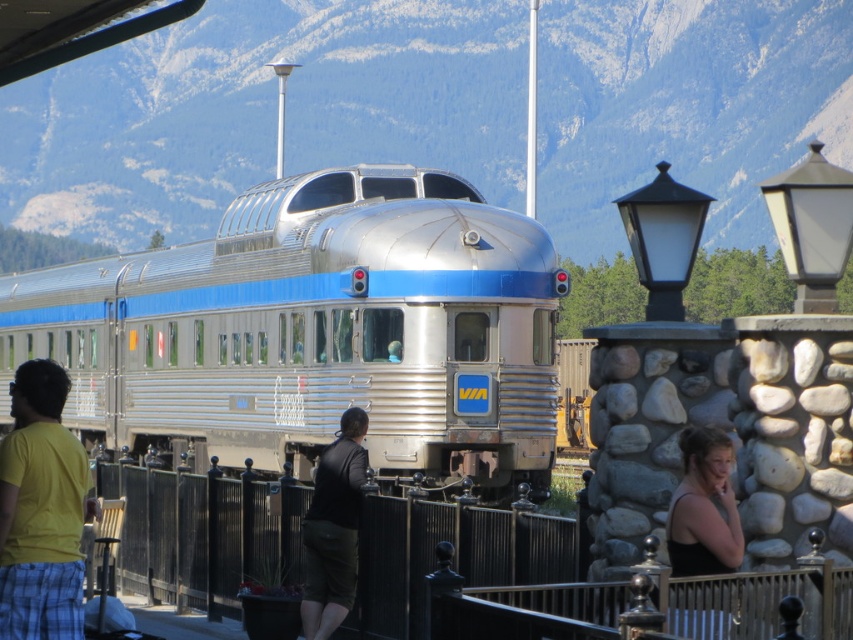
You are standing at the train station and want to walk from point A to point B. Point A is at coordinate point (126, 390) and point B is at coordinate point (4, 588). Given that the train is between you and the mountains, which direction should you move to reach point B from point A without crossing the tracks?

Since point A is closer to the viewer than point B, you should move away from the mountains towards the train station to reach point B from point A without crossing the tracks.